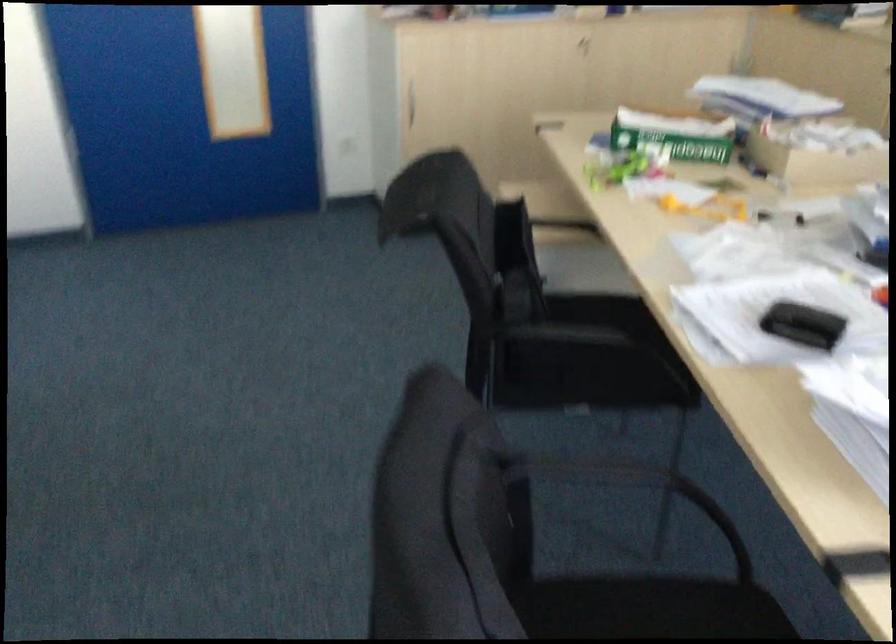
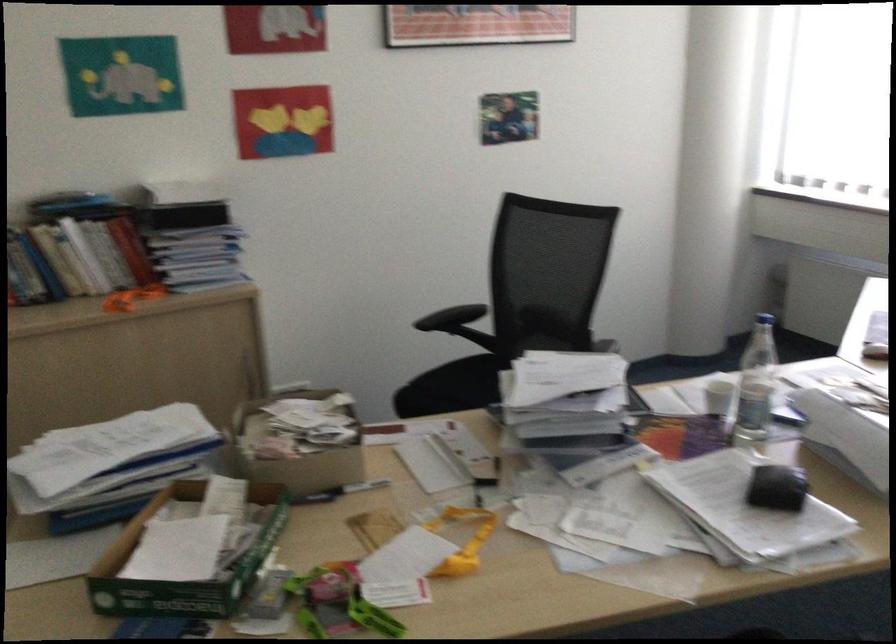
In the second image, find the point that corresponds to [636,122] in the first image.

(184, 564)